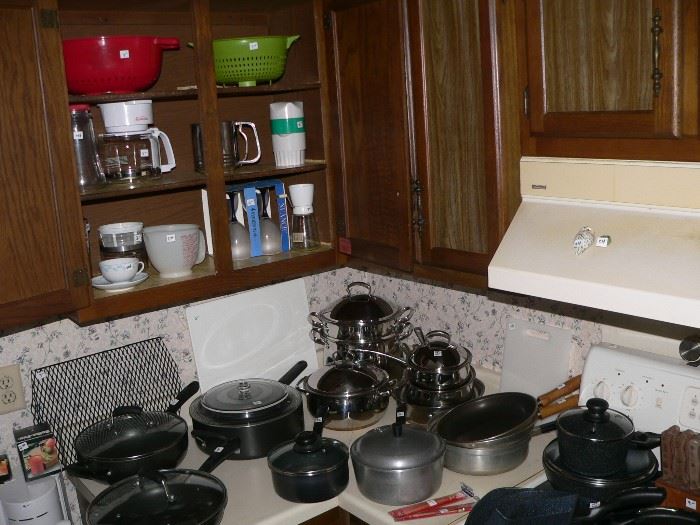
At what (x,y) coordinates should I click in order to perform the action: click on cutting boards. Please return your answer as a coordinate pair (x, y). Looking at the image, I should click on (532, 376), (280, 331).